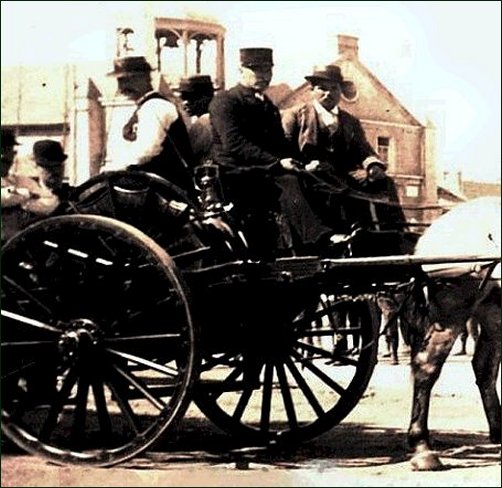
At what (x,y) coordinates should I click in order to perform the action: click on lantern. Please return your answer as a coordinate pair (x, y). Looking at the image, I should click on (208, 197).